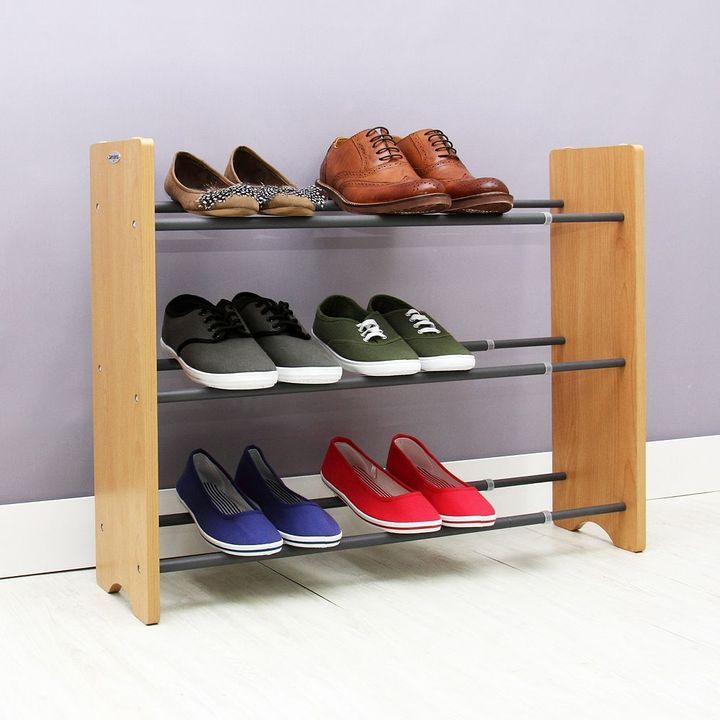
Where is `shoes on middle rack`? The width and height of the screenshot is (720, 720). shoes on middle rack is located at coordinates (219, 346), (302, 342), (372, 333), (433, 342).